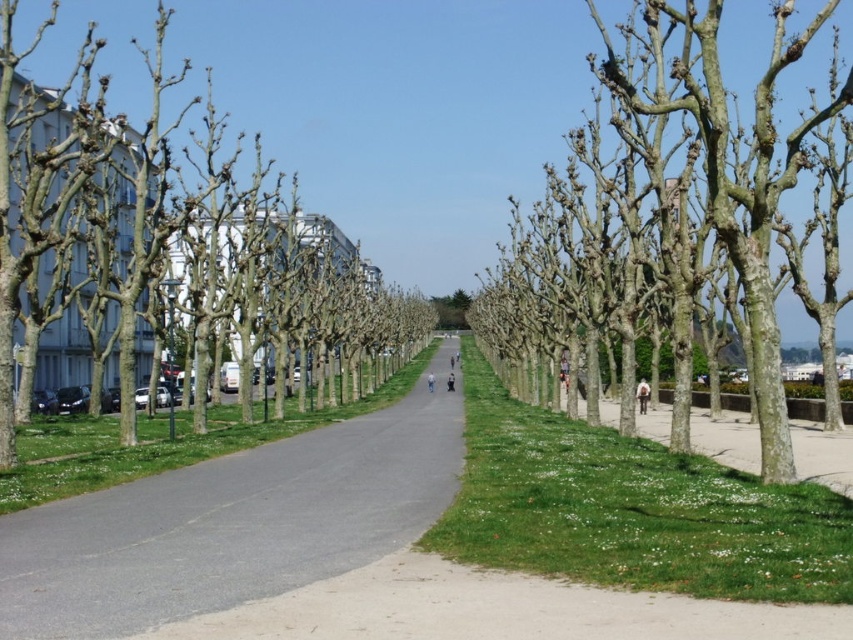
The height and width of the screenshot is (640, 853). What do you see at coordinates (231, 524) in the screenshot? I see `gray asphalt road at center` at bounding box center [231, 524].

Is gray asphalt road at center above bark textured trees at center?

Actually, gray asphalt road at center is below bark textured trees at center.

Measure the distance between gray asphalt road at center and camera.

gray asphalt road at center is 72.67 feet away from camera.

This screenshot has height=640, width=853. I want to click on gray asphalt road at center, so click(x=231, y=524).

Is bark textured trees at center smaller than smooth bark tree at left?

Correct, bark textured trees at center occupies less space than smooth bark tree at left.

Which is behind, point (675, 140) or point (54, 227)?

Point (675, 140)

Describe the element at coordinates (706, 164) in the screenshot. The width and height of the screenshot is (853, 640). I see `bark textured trees at center` at that location.

Locate an element on the screen. The image size is (853, 640). bark textured trees at center is located at coordinates (706, 164).

Who is shorter, gray asphalt road at center or smooth bark tree at left?

Standing shorter between the two is gray asphalt road at center.

Between gray asphalt road at center and smooth bark tree at left, which one is positioned higher?

smooth bark tree at left is above.

Where is `gray asphalt road at center`? gray asphalt road at center is located at coordinates pos(231,524).